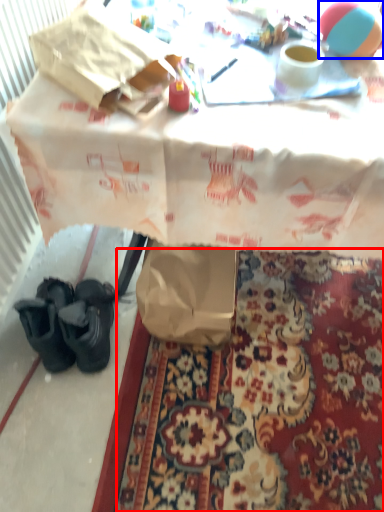
Question: Which point is further to the camera, mat (highlighted by a red box) or ball (highlighted by a blue box)?

Choices:
 (A) mat
 (B) ball

Answer: (A)